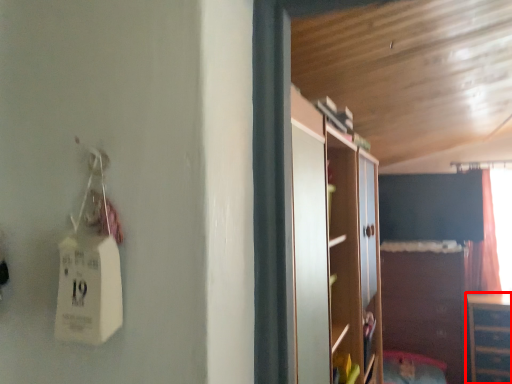
Question: From the image's perspective, what is the correct spatial relationship of cabinetry (annotated by the red box) in relation to cabinetry?

Choices:
 (A) below
 (B) above

Answer: (A)